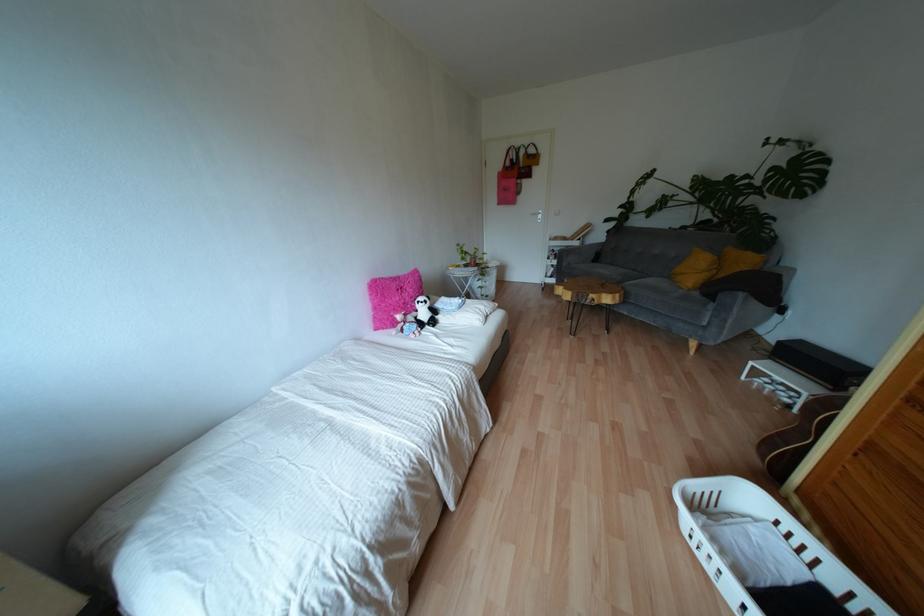
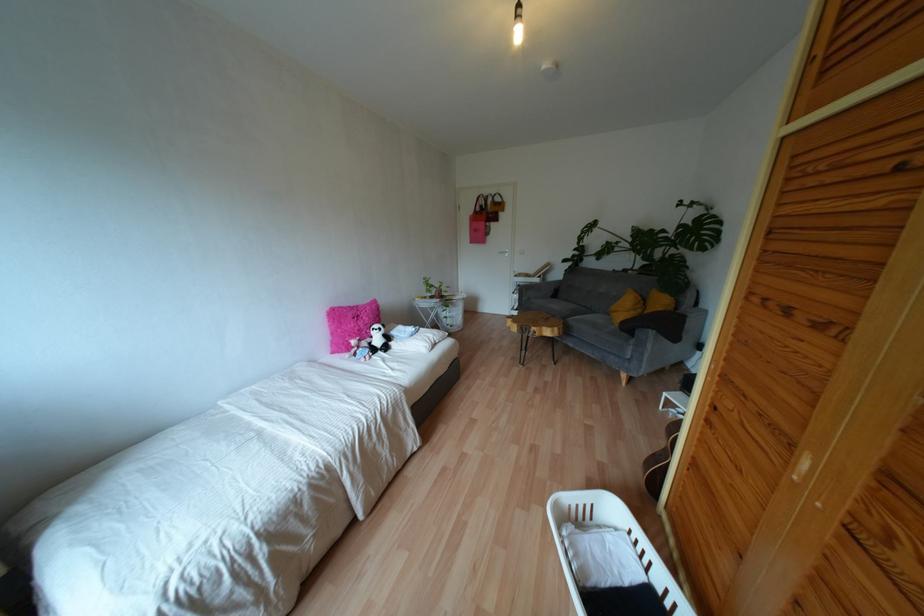
Find the pixel in the second image that matches point 383,304 in the first image.

(338, 330)